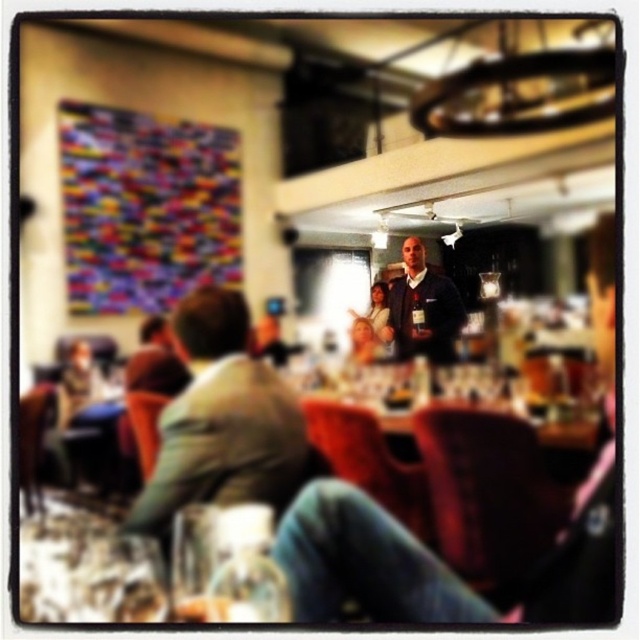
Does green fabric jacket at center lie in front of dark blue shirt at center?

Yes, green fabric jacket at center is in front of dark blue shirt at center.

Which is behind, point (211, 435) or point (448, 282)?

Point (448, 282)

Identify the location of green fabric jacket at center. (224, 422).

This screenshot has height=640, width=640. In order to click on green fabric jacket at center in this screenshot , I will do `click(224, 422)`.

Where is `green fabric jacket at center`? The image size is (640, 640). green fabric jacket at center is located at coordinates (224, 422).

Can you confirm if dark blue shirt at center is shorter than clear glass at lower left?

Incorrect, dark blue shirt at center's height does not fall short of clear glass at lower left's.

Which is behind, point (445, 360) or point (198, 604)?

Point (445, 360)

Where is `dark blue shirt at center`? The height and width of the screenshot is (640, 640). dark blue shirt at center is located at coordinates (422, 308).